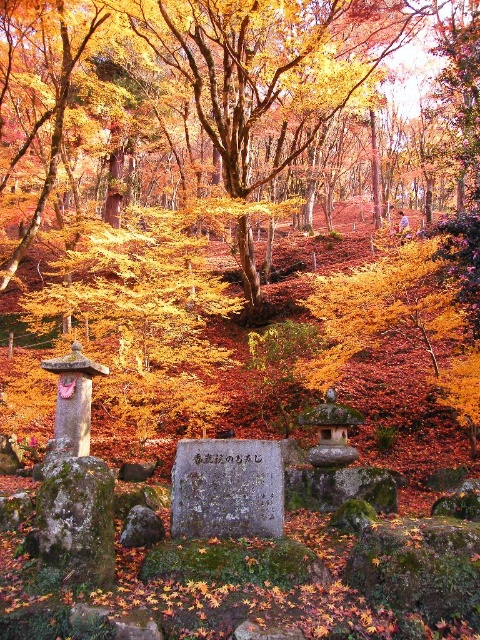
You are a photographer planning to take a photo of the gray stone plaque at center and the green mossy stone at center. You want to ensure both are visible in the frame. Based on their positions, which one should you focus on first to ensure both are in focus?

The gray stone plaque at center is above the green mossy stone at center. To ensure both are in focus, you should focus on the gray stone plaque at center first since it is farther away, allowing the depth of field to cover the closer green mossy stone at center.

You are a visitor at this memorial site and want to place a bouquet of flowers on the larger stone. Which one should you choose between the gray stone plaque at center and the green mossy stone at center?

The green mossy stone at center is larger than the gray stone plaque at center, so you should place the bouquet on the green mossy stone at center.